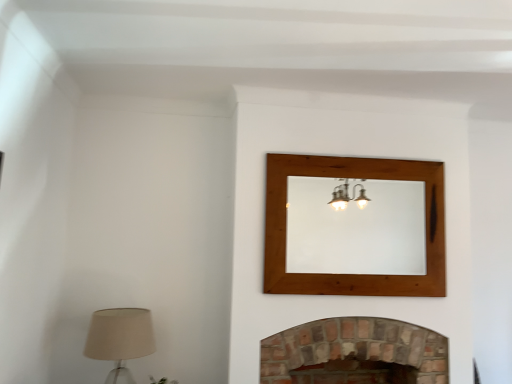
Question: Is brick fireplace at lower center to the right of beige fabric lampshade at lower left from the viewer's perspective?

Choices:
 (A) no
 (B) yes

Answer: (B)

Question: Does brick fireplace at lower center lie in front of beige fabric lampshade at lower left?

Choices:
 (A) yes
 (B) no

Answer: (B)

Question: Is beige fabric lampshade at lower left located within brick fireplace at lower center?

Choices:
 (A) no
 (B) yes

Answer: (A)

Question: Considering the relative sizes of brick fireplace at lower center and beige fabric lampshade at lower left in the image provided, is brick fireplace at lower center shorter than beige fabric lampshade at lower left?

Choices:
 (A) yes
 (B) no

Answer: (B)

Question: From a real-world perspective, is brick fireplace at lower center under beige fabric lampshade at lower left?

Choices:
 (A) no
 (B) yes

Answer: (B)

Question: In terms of width, does beige fabric lampshade at lower left look wider or thinner when compared to wooden mirror at upper center?

Choices:
 (A) wide
 (B) thin

Answer: (A)

Question: Is beige fabric lampshade at lower left bigger or smaller than wooden mirror at upper center?

Choices:
 (A) big
 (B) small

Answer: (A)

Question: Is beige fabric lampshade at lower left situated inside wooden mirror at upper center or outside?

Choices:
 (A) outside
 (B) inside

Answer: (A)

Question: Is point (132, 332) closer or farther from the camera than point (307, 231)?

Choices:
 (A) farther
 (B) closer

Answer: (B)

Question: In terms of height, does wooden mirror at upper center look taller or shorter compared to brick fireplace at lower center?

Choices:
 (A) short
 (B) tall

Answer: (B)

Question: Is wooden mirror at upper center spatially inside brick fireplace at lower center, or outside of it?

Choices:
 (A) outside
 (B) inside

Answer: (A)

Question: From the image's perspective, is wooden mirror at upper center located above or below brick fireplace at lower center?

Choices:
 (A) below
 (B) above

Answer: (B)

Question: Considering the positions of wooden mirror at upper center and brick fireplace at lower center in the image, is wooden mirror at upper center bigger or smaller than brick fireplace at lower center?

Choices:
 (A) small
 (B) big

Answer: (A)

Question: Is beige fabric lampshade at lower left taller or shorter than brick fireplace at lower center?

Choices:
 (A) short
 (B) tall

Answer: (A)

Question: Visually, is beige fabric lampshade at lower left positioned to the left or to the right of brick fireplace at lower center?

Choices:
 (A) left
 (B) right

Answer: (A)